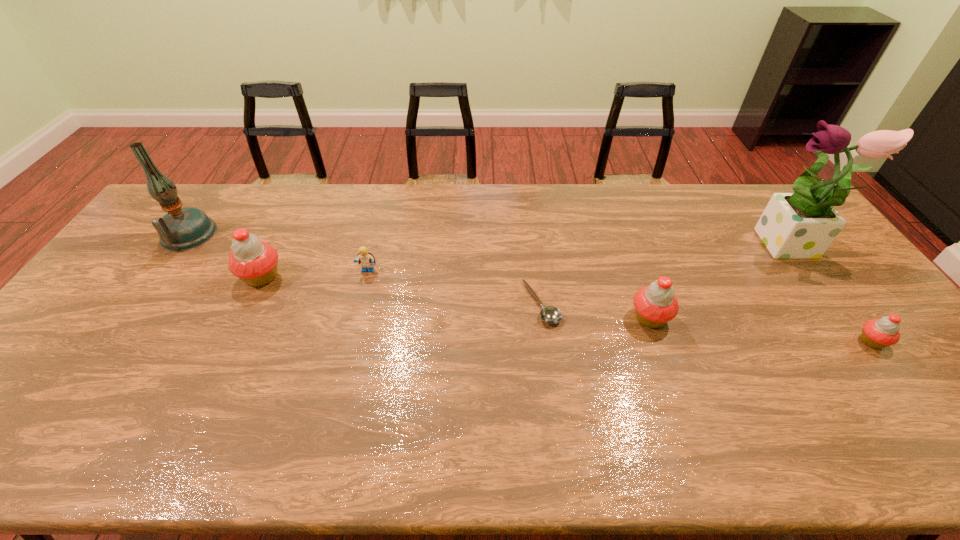
Image resolution: width=960 pixels, height=540 pixels. I want to click on object that is the second closest one to the shortest cupcake, so click(656, 304).

I want to click on the second closest cupcake to the fifth object from right to left, so click(x=656, y=304).

Locate which cupcake is the closest to the rightmost cupcake. Please provide its 2D coordinates. Your answer should be formatted as a tuple, i.e. [(x, y)], where the tuple contains the x and y coordinates of a point satisfying the conditions above.

[(656, 304)]

The height and width of the screenshot is (540, 960). Identify the location of free space that satisfies the following two spatial constraints: 1. on the front side of the farthest cupcake; 2. on the left side of the rightmost cupcake. (230, 341).

I want to click on free spot that satisfies the following two spatial constraints: 1. on the front-facing side of the fourth tallest object; 2. on the right side of the third object from left to right, so click(356, 318).

Identify the location of free space that satisfies the following two spatial constraints: 1. on the front-facing side of the rightmost cupcake; 2. on the left side of the fifth object from right to left. This screenshot has height=540, width=960. (350, 341).

The image size is (960, 540). In order to click on vacant area in the image that satisfies the following two spatial constraints: 1. on the front side of the ladle; 2. on the right side of the oil lamp in this screenshot , I will do `click(139, 303)`.